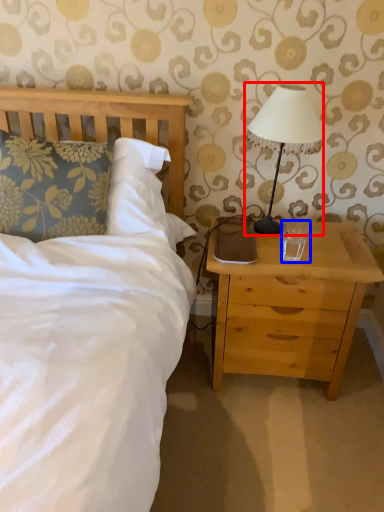
Question: Among these objects, which one is nearest to the camera, table lamp (highlighted by a red box) or coffee cup (highlighted by a blue box)?

Choices:
 (A) table lamp
 (B) coffee cup

Answer: (A)